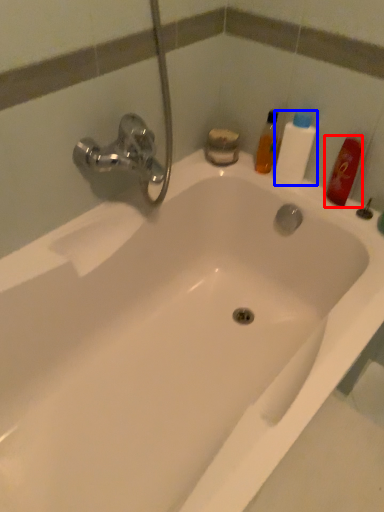
Question: Which object is closer to the camera taking this photo, mouthwash (highlighted by a red box) or cleaning product (highlighted by a blue box)?

Choices:
 (A) mouthwash
 (B) cleaning product

Answer: (A)